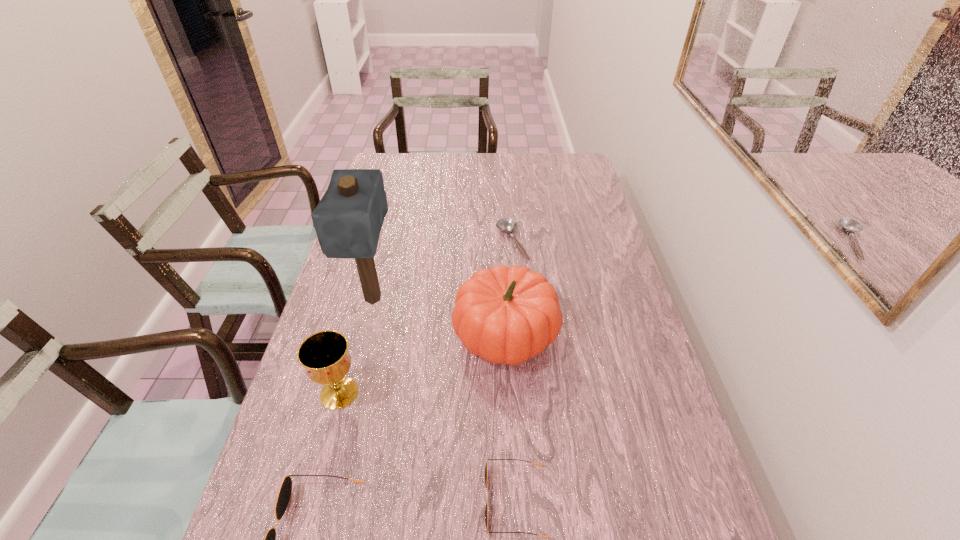
I want to click on blank space located on the front of the tallest object, so click(350, 394).

This screenshot has width=960, height=540. I want to click on free location located 0.230m on the back of the ladle, so click(507, 188).

At what (x,y) coordinates should I click in order to perform the action: click on vacant space located on the right of the pumpkin. Please return your answer as a coordinate pair (x, y). Looking at the image, I should click on (602, 334).

Where is `free space located 0.210m on the back of the chalice`? The image size is (960, 540). free space located 0.210m on the back of the chalice is located at coordinates (361, 312).

Find the location of a particular element. object that is at the near edge is located at coordinates (486, 470).

This screenshot has height=540, width=960. What are the coordinates of `mallet present at the left edge` in the screenshot? It's located at (348, 219).

Image resolution: width=960 pixels, height=540 pixels. I want to click on chalice present at the left edge, so click(x=324, y=355).

The width and height of the screenshot is (960, 540). I want to click on vacant region at the far edge, so click(531, 159).

Image resolution: width=960 pixels, height=540 pixels. Find the location of `vacant region at the near edge of the desktop`. vacant region at the near edge of the desktop is located at coordinates (506, 528).

At what (x,y) coordinates should I click in order to perform the action: click on free space at the left edge of the desktop. Please return your answer as a coordinate pair (x, y). Looking at the image, I should click on (321, 393).